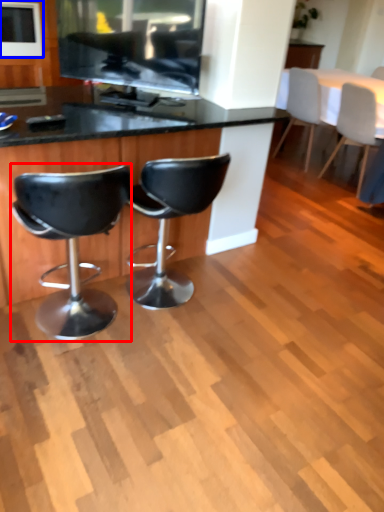
Question: Which of the following is the farthest to the observer, chair (highlighted by a red box) or appliance (highlighted by a blue box)?

Choices:
 (A) chair
 (B) appliance

Answer: (B)